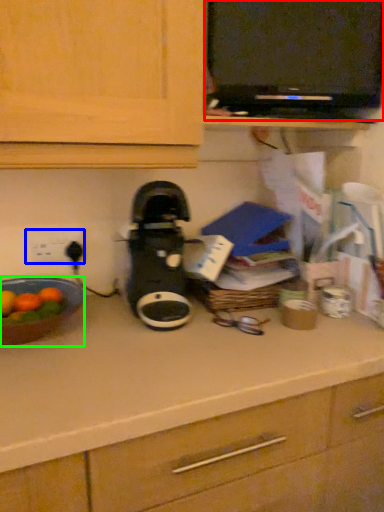
Question: Estimate the real-world distances between objects in this image. Which object is closer to appliance (highlighted by a red box), electric outlet (highlighted by a blue box) or kitchen appliance (highlighted by a green box)?

Choices:
 (A) electric outlet
 (B) kitchen appliance

Answer: (A)